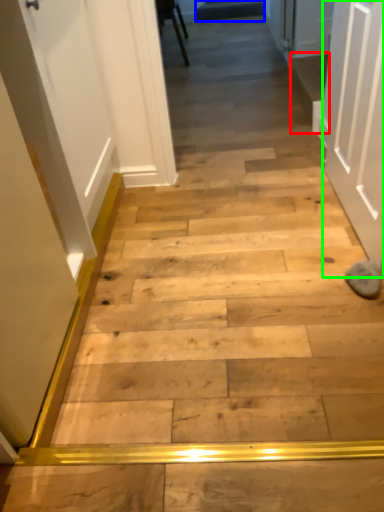
Question: Which object is positioned farthest from stairwell (highlighted by a red box)? Select from stairwell (highlighted by a blue box) and door (highlighted by a green box).

Choices:
 (A) stairwell
 (B) door

Answer: (A)